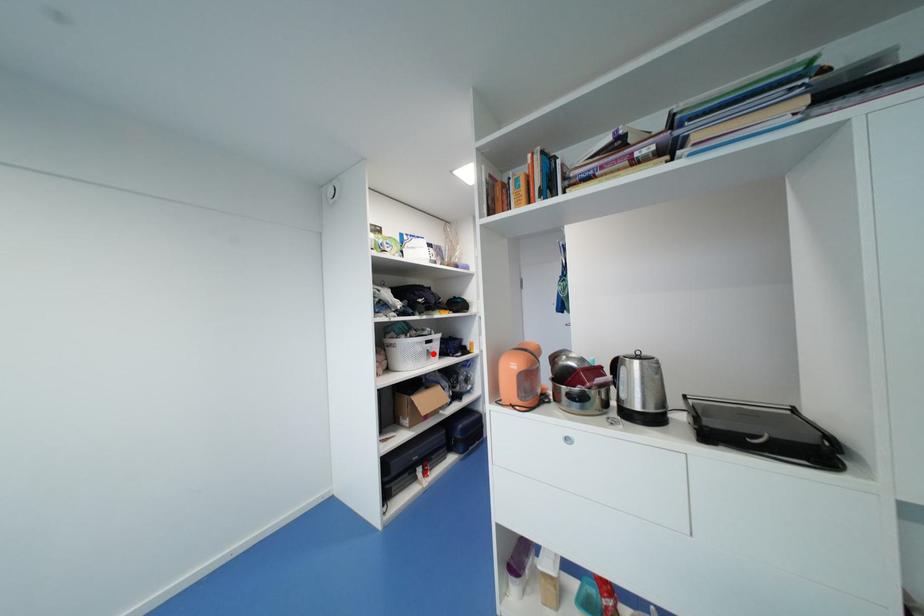
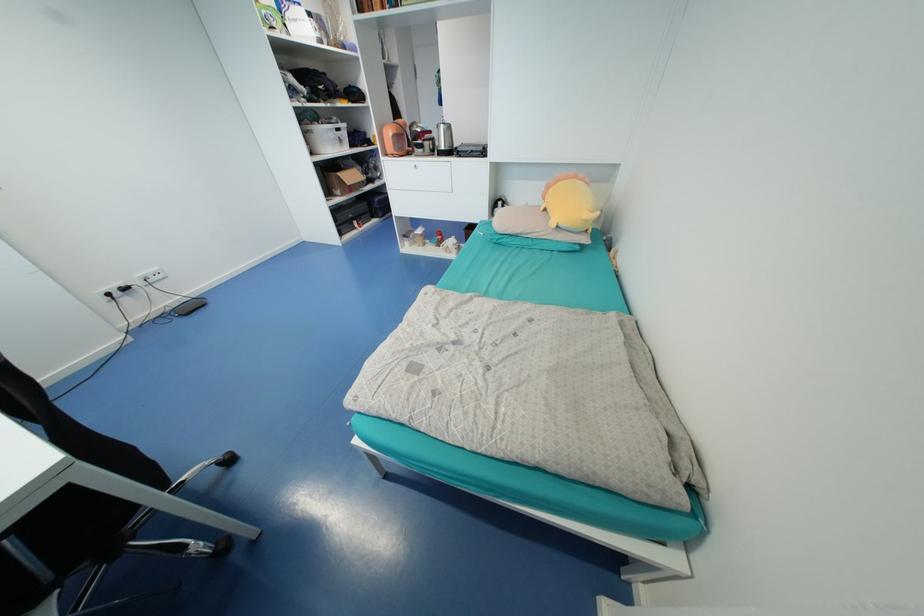
The point at the highlighted location is marked in the first image. Where is the corresponding point in the second image?

(345, 140)